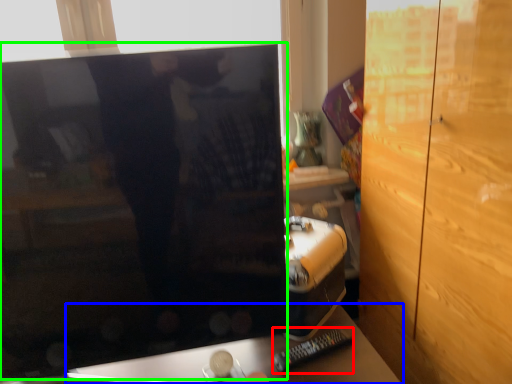
Question: Which is nearer to the remote (highlighted by a red box)? furniture (highlighted by a blue box) or computer monitor (highlighted by a green box).

Choices:
 (A) furniture
 (B) computer monitor

Answer: (A)